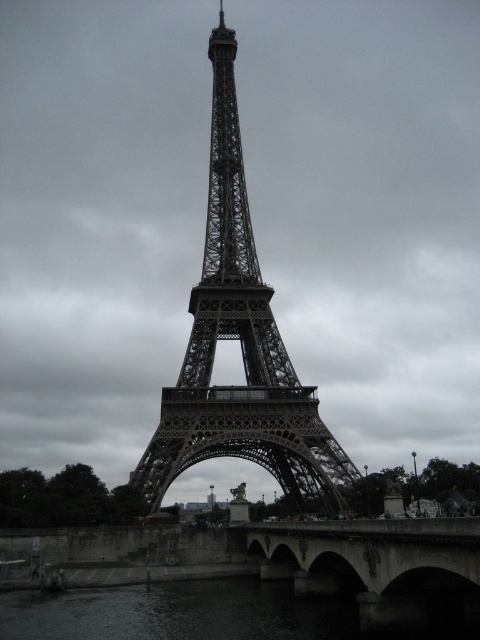
Question: Is metallic lattice tower at center to the right of concrete bridge at lower center from the viewer's perspective?

Choices:
 (A) yes
 (B) no

Answer: (B)

Question: Can you confirm if dark water at lower center is bigger than concrete bridge at lower center?

Choices:
 (A) yes
 (B) no

Answer: (B)

Question: Among these objects, which one is farthest from the camera?

Choices:
 (A) concrete bridge at lower center
 (B) dark water at lower center
 (C) metallic lattice tower at center

Answer: (B)

Question: Which is farther from the concrete bridge at lower center?

Choices:
 (A) dark water at lower center
 (B) metallic lattice tower at center

Answer: (B)

Question: Is the position of dark water at lower center more distant than that of concrete bridge at lower center?

Choices:
 (A) no
 (B) yes

Answer: (B)

Question: Which object is the closest to the concrete bridge at lower center?

Choices:
 (A) metallic lattice tower at center
 (B) dark water at lower center

Answer: (B)